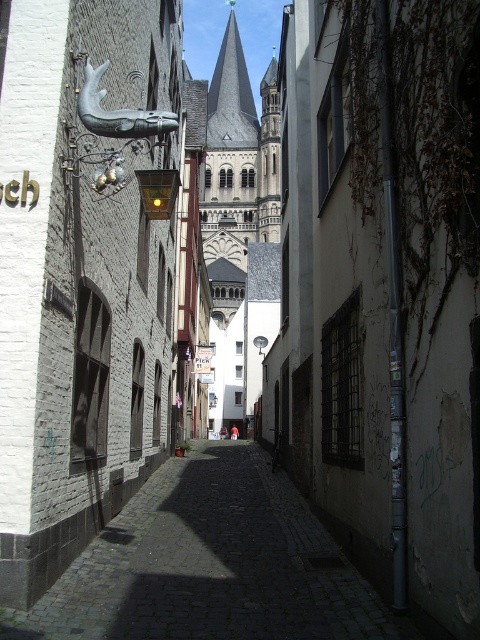
Question: Which of the following is the closest to the observer?

Choices:
 (A) (304, 520)
 (B) (372, 454)

Answer: (B)

Question: Where is smooth concrete wall at center located in relation to cobblestone street at center in the image?

Choices:
 (A) right
 (B) left

Answer: (A)

Question: Observing the image, what is the correct spatial positioning of smooth concrete wall at center in reference to cobblestone street at center?

Choices:
 (A) above
 (B) below

Answer: (A)

Question: Is smooth concrete wall at center positioned behind cobblestone street at center?

Choices:
 (A) no
 (B) yes

Answer: (A)

Question: Which point is farther from the camera taking this photo?

Choices:
 (A) (317, 538)
 (B) (370, 154)

Answer: (A)